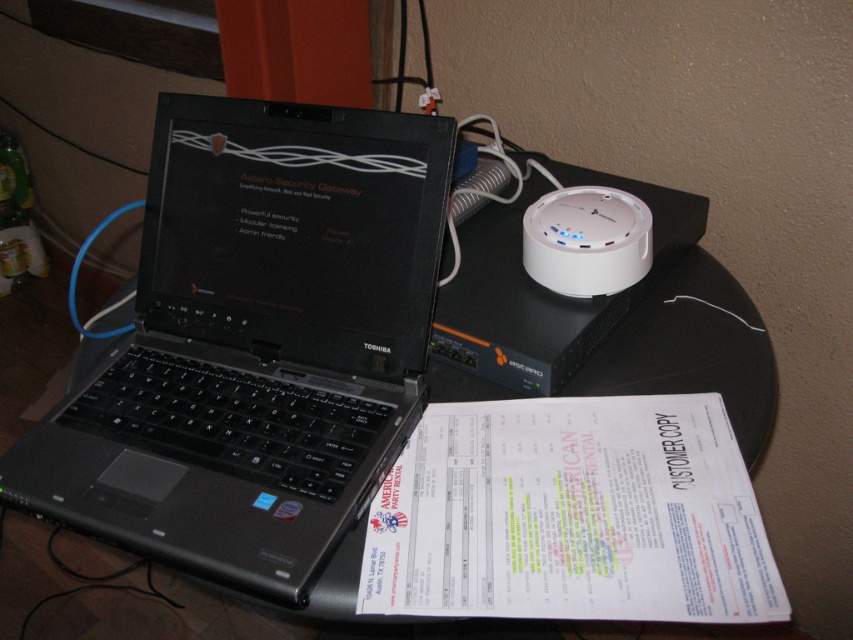
From the picture: Can you confirm if white paper at lower center is positioned above white plastic device at upper right?

No, white paper at lower center is not above white plastic device at upper right.

Is the position of white paper at lower center more distant than that of white plastic device at upper right?

No, it is not.

Is point (619, 532) positioned before point (552, 273)?

Yes, it is in front of point (552, 273).

Where is `white paper at lower center`? The width and height of the screenshot is (853, 640). white paper at lower center is located at coordinates (572, 515).

Can you confirm if black plastic laptop at center is positioned to the left of white plastic device at upper right?

Yes, black plastic laptop at center is to the left of white plastic device at upper right.

Does black plastic laptop at center appear under white plastic device at upper right?

Indeed, black plastic laptop at center is positioned under white plastic device at upper right.

Between point (113, 444) and point (570, 284), which one is positioned behind?

The point (570, 284) is behind.

The height and width of the screenshot is (640, 853). In order to click on black plastic laptop at center in this screenshot , I will do `click(256, 342)`.

Between black plastic laptop at center and white paper at lower center, which one is positioned higher?

black plastic laptop at center is above.

Does black plastic laptop at center have a larger size compared to white paper at lower center?

Indeed, black plastic laptop at center has a larger size compared to white paper at lower center.

At what (x,y) coordinates should I click in order to perform the action: click on black plastic laptop at center. Please return your answer as a coordinate pair (x, y). The width and height of the screenshot is (853, 640). Looking at the image, I should click on (256, 342).